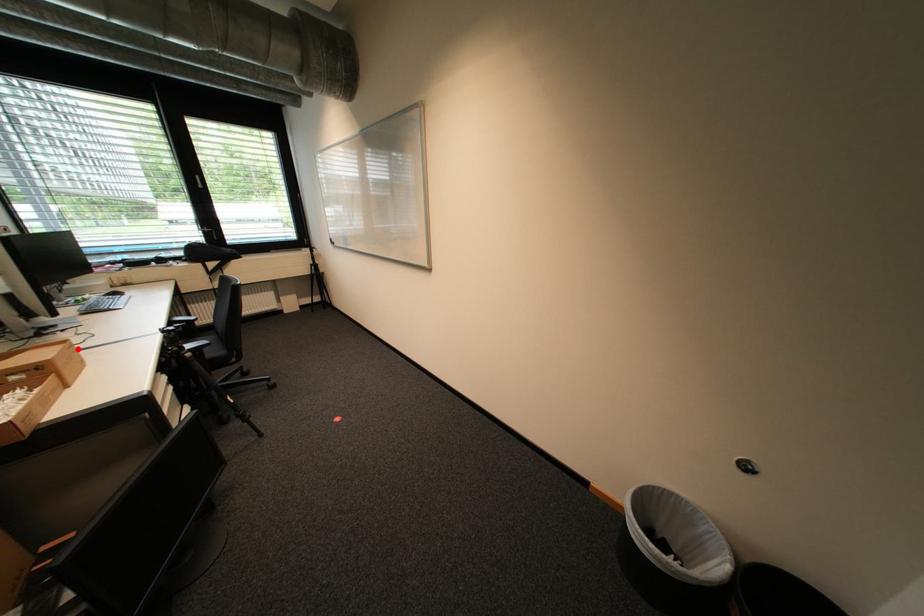
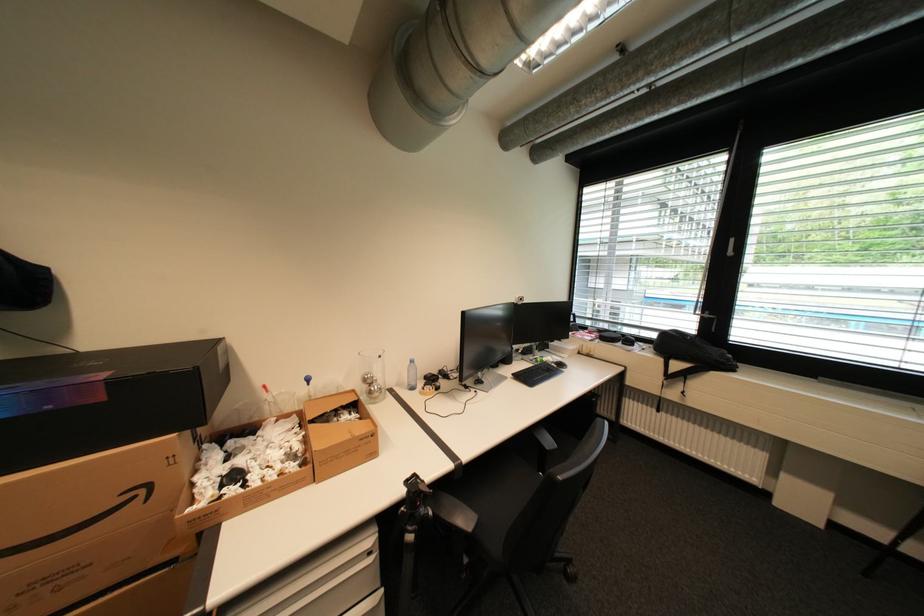
Locate, in the second image, the point that corresponds to the highlighted location in the first image.

(370, 440)